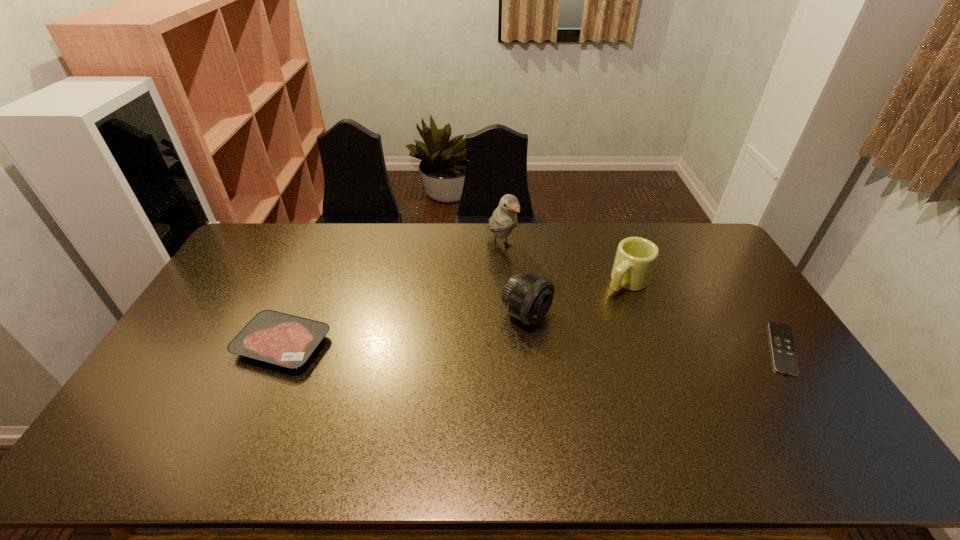
Locate an element on the screen. Image resolution: width=960 pixels, height=540 pixels. vacant space situated 0.310m at the face of the farthest object is located at coordinates (554, 320).

This screenshot has width=960, height=540. I want to click on free region located 0.290m at the face of the farthest object, so click(x=550, y=316).

Where is `free space located at the face of the farthest object`? This screenshot has width=960, height=540. free space located at the face of the farthest object is located at coordinates (561, 328).

Locate an element on the screen. The width and height of the screenshot is (960, 540). free space located with the handle on the side of the mug is located at coordinates (552, 354).

The image size is (960, 540). Find the location of `vacant space located with the handle on the side of the mug`. vacant space located with the handle on the side of the mug is located at coordinates (603, 305).

The image size is (960, 540). I want to click on free point located 0.290m with the handle on the side of the mug, so click(x=566, y=341).

This screenshot has height=540, width=960. Identify the location of vacant position located 0.180m on the front-facing side of the telephoto lens. (602, 356).

I want to click on free space located 0.240m on the front-facing side of the telephoto lens, so click(x=621, y=367).

At what (x,y) coordinates should I click in order to perform the action: click on free space located on the front-facing side of the telephoto lens. Please return your answer as a coordinate pair (x, y). The height and width of the screenshot is (540, 960). Looking at the image, I should click on (612, 362).

Identify the location of object at the far edge. (504, 219).